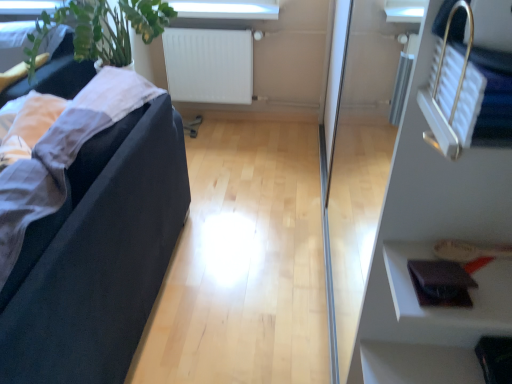
Question: Based on their sizes in the image, would you say leather wallet at lower right is bigger or smaller than transparent glass door at right?

Choices:
 (A) big
 (B) small

Answer: (B)

Question: Considering the positions of point (429, 317) and point (324, 218), is point (429, 317) closer or farther from the camera than point (324, 218)?

Choices:
 (A) closer
 (B) farther

Answer: (A)

Question: Which object is positioned closest to the black fabric couch at left?

Choices:
 (A) transparent glass door at right
 (B) leather wallet at lower right
 (C) white matte radiator at upper center

Answer: (B)

Question: Estimate the real-world distances between objects in this image. Which object is closer to the transparent glass door at right?

Choices:
 (A) leather wallet at lower right
 (B) white matte radiator at upper center
 (C) black fabric couch at left

Answer: (B)